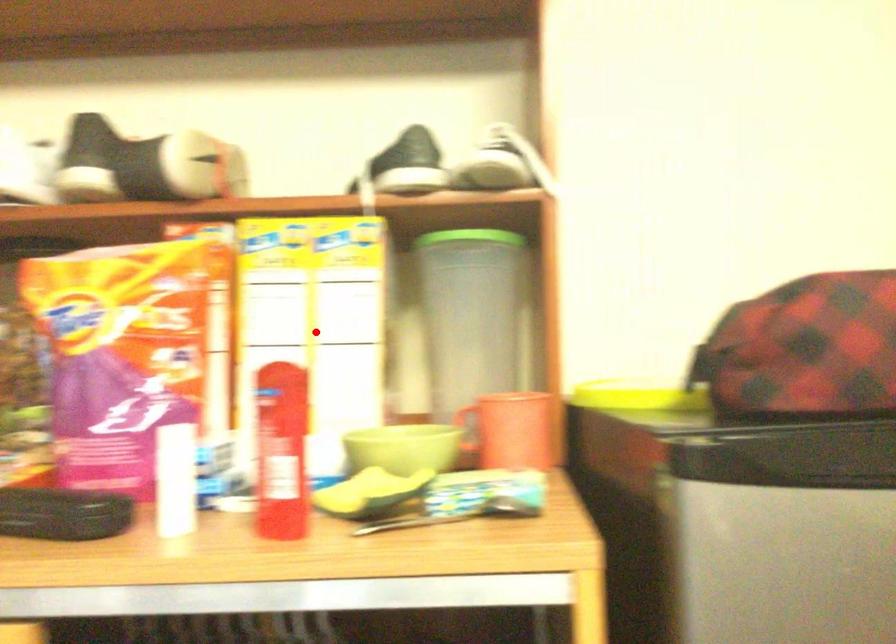
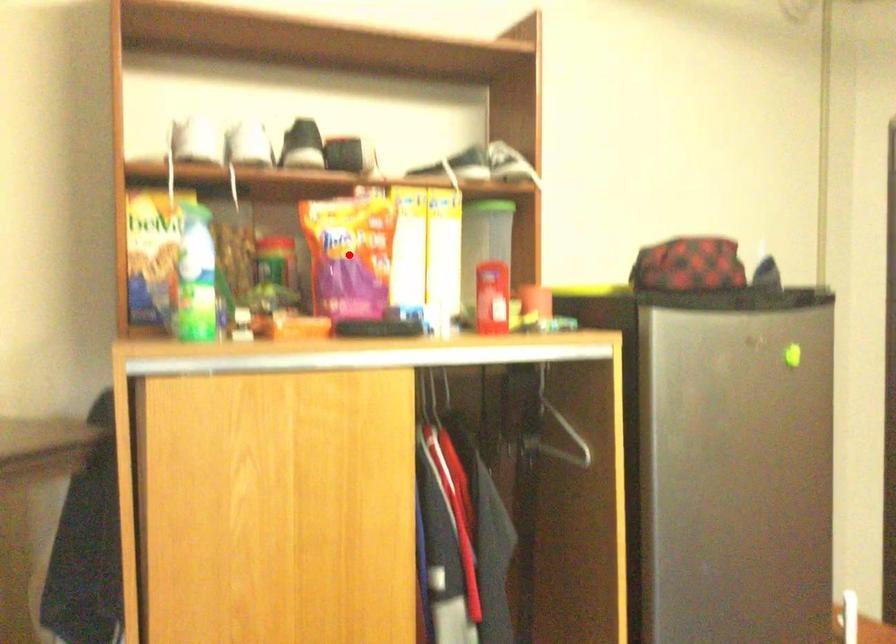
I am providing you with two images of the same scene from different viewpoints. A red point is marked on the first image and another point is marked on the second image. Are the points marked in image1 and image2 representing the same 3D position?

No